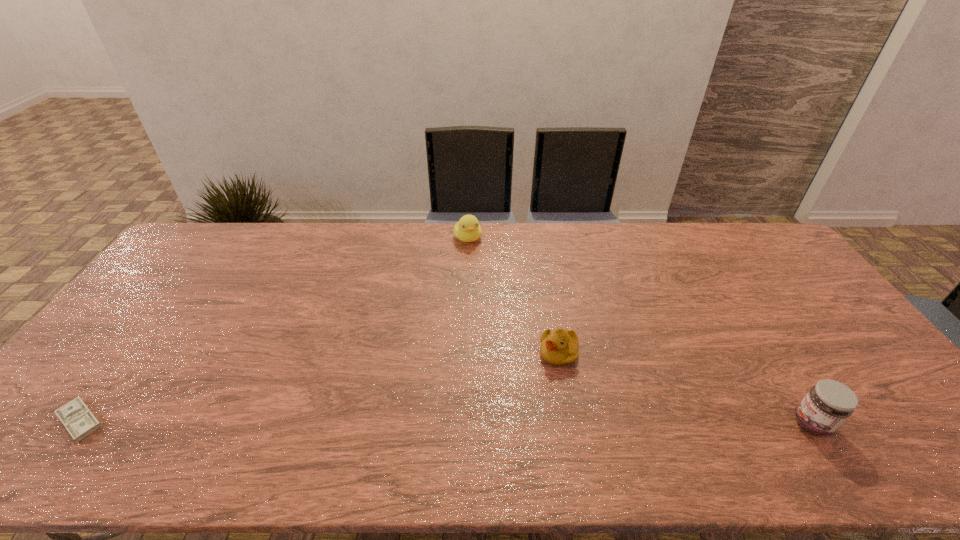
Find the location of a particular element. vacant region that satisfies the following two spatial constraints: 1. on the front side of the rightmost object; 2. on the front label of the farther duckling is located at coordinates (462, 423).

I want to click on vacant space that satisfies the following two spatial constraints: 1. on the front side of the shortest object; 2. on the front label of the jam, so click(78, 423).

The image size is (960, 540). Find the location of `free location that satisfies the following two spatial constraints: 1. on the front side of the farther duckling; 2. on the left side of the nearer duckling`. free location that satisfies the following two spatial constraints: 1. on the front side of the farther duckling; 2. on the left side of the nearer duckling is located at coordinates (464, 353).

The width and height of the screenshot is (960, 540). What are the coordinates of `free location that satisfies the following two spatial constraints: 1. on the front side of the third object from right to left; 2. on the front label of the rightmost object` in the screenshot? It's located at (462, 423).